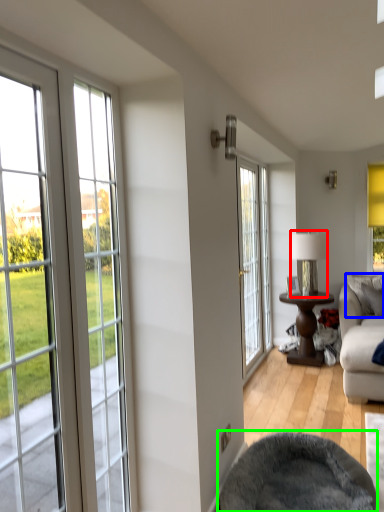
Question: Considering the real-world distances, which object is farthest from lamp (highlighted by a red box)? pillow (highlighted by a blue box) or bean bag chair (highlighted by a green box)?

Choices:
 (A) pillow
 (B) bean bag chair

Answer: (B)